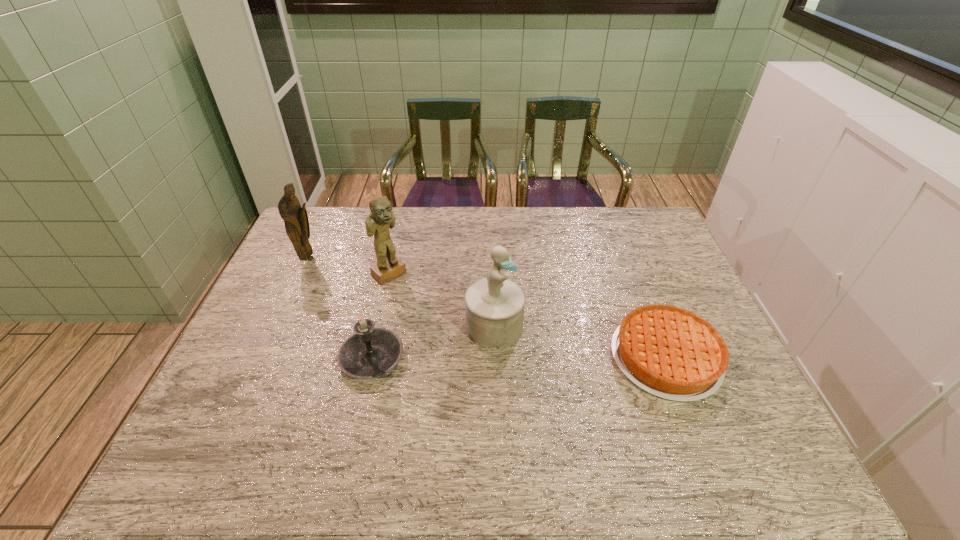
This screenshot has height=540, width=960. In order to click on vacant space on the desktop that is between the candle and the rightmost object and is positioned on the front-facing side of the leftmost object in this screenshot , I will do `click(494, 357)`.

What are the coordinates of `vacant space on the desktop that is between the fourth tallest object and the rightmost object and is positioned on the front-facing side of the second figurine from left to right` in the screenshot? It's located at (481, 357).

Where is `free space on the desktop that is between the fourth tallest object and the rightmost object and is positioned at the beak of the rightmost figurine`? Image resolution: width=960 pixels, height=540 pixels. free space on the desktop that is between the fourth tallest object and the rightmost object and is positioned at the beak of the rightmost figurine is located at coordinates (561, 357).